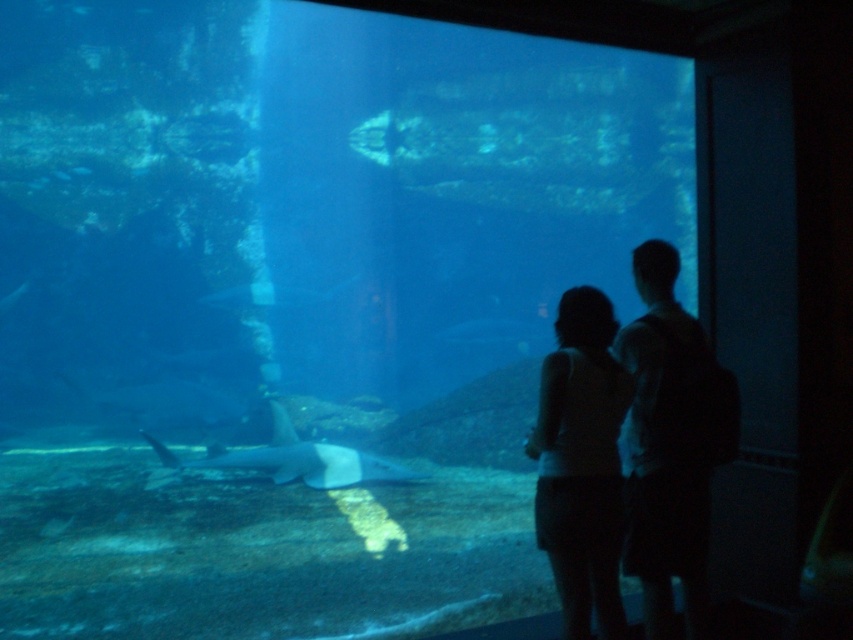
Who is shorter, silhouette human at center or silhouette fabric at center?

silhouette fabric at center

This screenshot has width=853, height=640. I want to click on silhouette human at center, so click(x=671, y=444).

Is point (682, 532) positioned in front of point (555, 397)?

That is False.

Where is `silhouette human at center`? silhouette human at center is located at coordinates (671, 444).